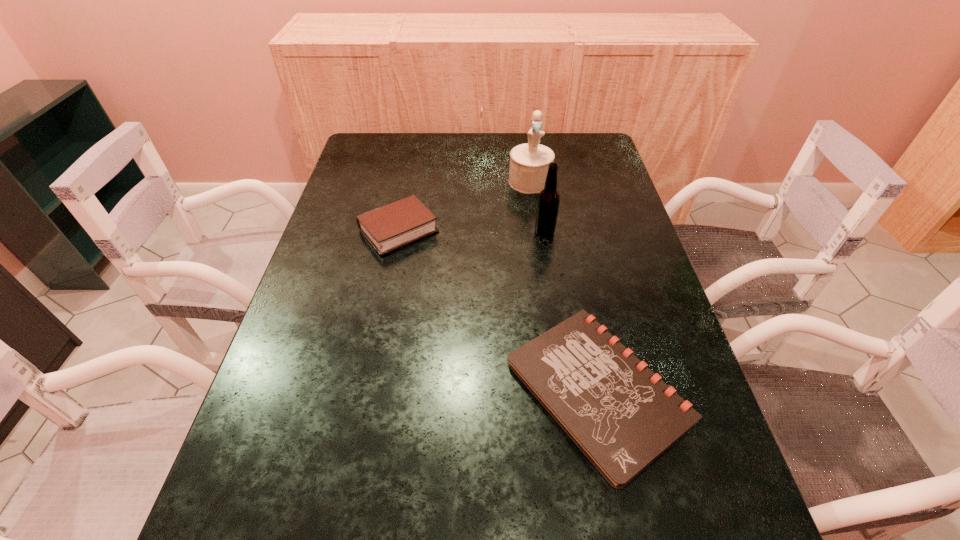
Find the location of `vacant region that satisfies the following two spatial constraints: 1. at the beak of the notebook; 2. on the left side of the farthest object`. vacant region that satisfies the following two spatial constraints: 1. at the beak of the notebook; 2. on the left side of the farthest object is located at coordinates (559, 390).

Find the location of a particular element. This screenshot has height=540, width=960. free location that satisfies the following two spatial constraints: 1. at the beak of the beer bottle; 2. on the left side of the figurine is located at coordinates (537, 232).